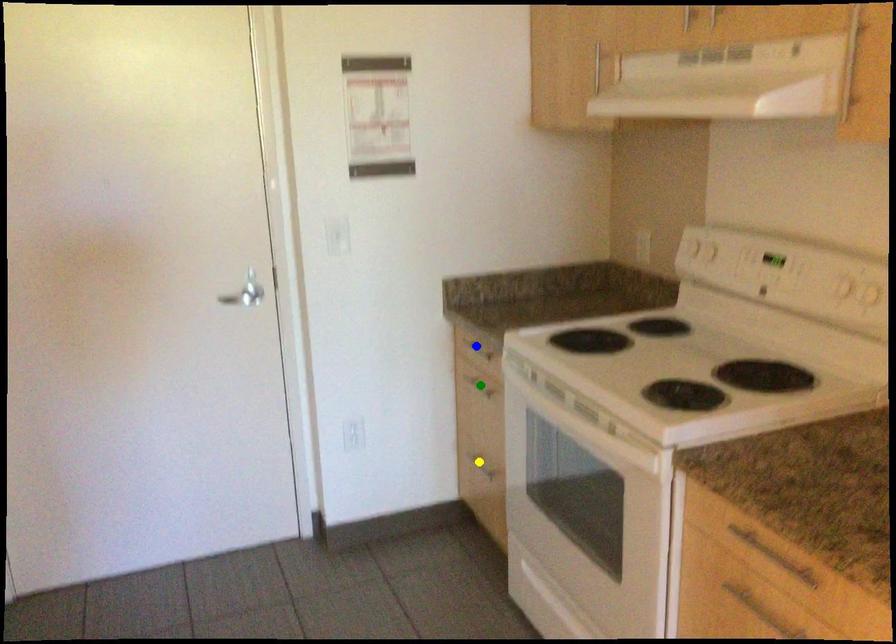
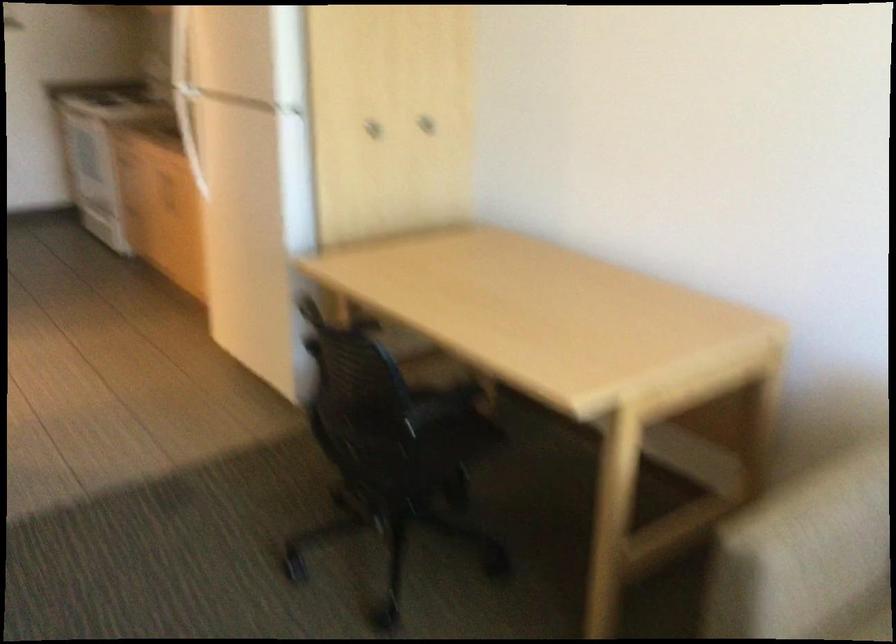
I am providing you with two images of the same scene from different viewpoints. Three points are marked in image1. Which point corresponds to a part or object that is occluded in image2?In image1, three points are marked. Which of them correspond to a part or object that is occluded in image2?Among the three points shown in image1, which one corresponds to a part or object that is no longer visible due to occlusion in image2?

green point, yellow point, blue point